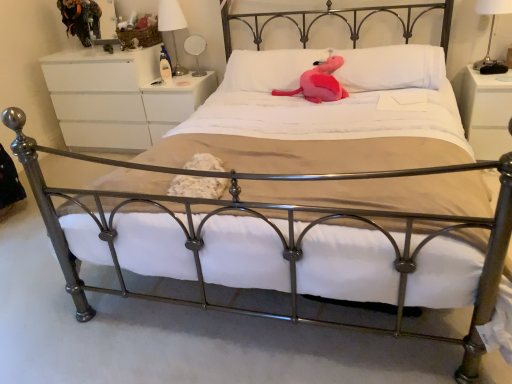
Locate an element on the screen. The image size is (512, 384). space that is in front of white glossy lampshade at upper center, arranged as the first bedside lamp when viewed from the left is located at coordinates (182, 82).